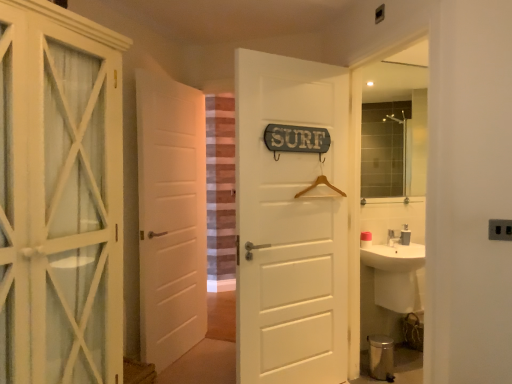
Question: Is white matte door at center, which is the third door from front to back, oriented towards matte glass mirror at upper right?

Choices:
 (A) no
 (B) yes

Answer: (A)

Question: Is white matte door at center, which is the third door from front to back, taller than matte glass mirror at upper right?

Choices:
 (A) yes
 (B) no

Answer: (A)

Question: Is white matte door at center, which is counted as the second door, starting from the right, at the right side of matte glass mirror at upper right?

Choices:
 (A) yes
 (B) no

Answer: (B)

Question: Would you say white matte door at center, the 2th door in the left-to-right sequence, contains matte glass mirror at upper right?

Choices:
 (A) no
 (B) yes

Answer: (A)

Question: Is white matte door at center, the 2th door in the left-to-right sequence, placed right next to matte glass mirror at upper right?

Choices:
 (A) no
 (B) yes

Answer: (A)

Question: In the image, is white wooden cabinet at left, the 1th door in the left-to-right sequence, positioned in front of or behind black plastic electric outlet at lower right?

Choices:
 (A) behind
 (B) front

Answer: (B)

Question: Is point [105, 77] closer or farther from the camera than point [496, 221]?

Choices:
 (A) closer
 (B) farther

Answer: (B)

Question: Considering the relative positions of white wooden cabinet at left, the first door when ordered from front to back, and black plastic electric outlet at lower right in the image provided, is white wooden cabinet at left, the first door when ordered from front to back, to the left or to the right of black plastic electric outlet at lower right?

Choices:
 (A) right
 (B) left

Answer: (B)

Question: From the image's perspective, relative to black plastic electric outlet at lower right, is white wooden cabinet at left, the first door when ordered from front to back, above or below?

Choices:
 (A) above
 (B) below

Answer: (B)

Question: Is black plastic electric outlet at lower right inside the boundaries of white glossy sink at right, or outside?

Choices:
 (A) inside
 (B) outside

Answer: (B)

Question: From the image's perspective, is black plastic electric outlet at lower right located above or below white glossy sink at right?

Choices:
 (A) above
 (B) below

Answer: (A)

Question: In terms of size, does black plastic electric outlet at lower right appear bigger or smaller than white glossy sink at right?

Choices:
 (A) big
 (B) small

Answer: (B)

Question: From a real-world perspective, is black plastic electric outlet at lower right above or below white glossy sink at right?

Choices:
 (A) below
 (B) above

Answer: (B)

Question: Is white wooden cabinet at left, the 3th door when ordered from back to front, inside the boundaries of metallic silver toilet bowl at lower right, or outside?

Choices:
 (A) outside
 (B) inside

Answer: (A)

Question: Considering the positions of white wooden cabinet at left, the 3th door when ordered from back to front, and metallic silver toilet bowl at lower right in the image, is white wooden cabinet at left, the 3th door when ordered from back to front, taller or shorter than metallic silver toilet bowl at lower right?

Choices:
 (A) tall
 (B) short

Answer: (A)